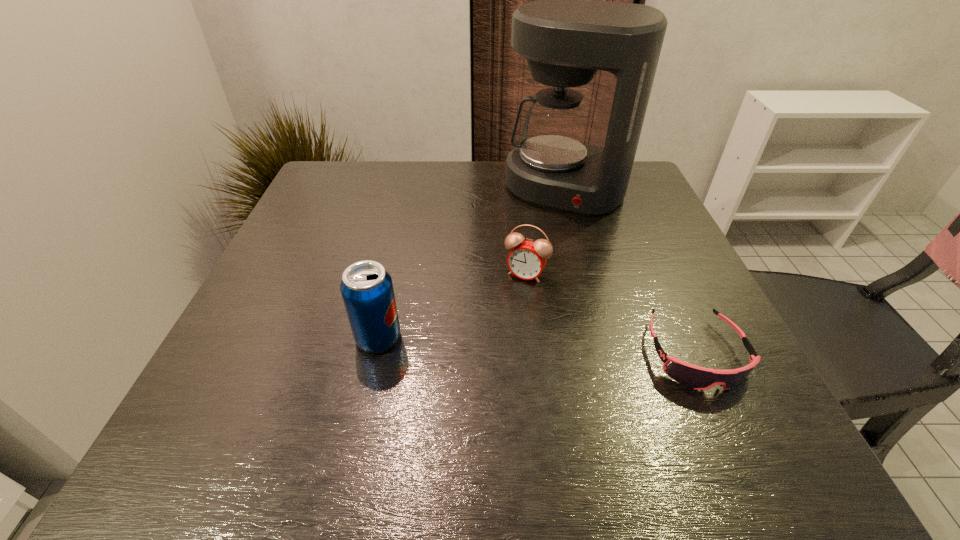
Locate an element on the screen. This screenshot has width=960, height=540. free space between the third shortest object and the goggles is located at coordinates (537, 346).

Where is `vacant point located between the tallest object and the pop soda`? Image resolution: width=960 pixels, height=540 pixels. vacant point located between the tallest object and the pop soda is located at coordinates 471,264.

Identify the location of vacant space that's between the farthest object and the second farthest object. (545, 232).

Find the location of a particular element. This screenshot has width=960, height=540. free space that is in between the shortest object and the third nearest object is located at coordinates (611, 314).

This screenshot has height=540, width=960. Find the location of `empty location between the coffee maker and the pop soda`. empty location between the coffee maker and the pop soda is located at coordinates (471, 264).

The image size is (960, 540). Identify the location of blank region between the alarm clock and the third shortest object. (452, 306).

Where is `free space between the coffee maker and the third tallest object`? This screenshot has height=540, width=960. free space between the coffee maker and the third tallest object is located at coordinates [545, 232].

You are a GUI agent. You are given a task and a screenshot of the screen. Output one action in this format:
    pyautogui.click(x=<x>, y=<y>)
    Task: Click on the object that is the closest one to the farthest object
    This screenshot has width=960, height=540.
    Given the screenshot: What is the action you would take?
    pyautogui.click(x=527, y=259)

Locate which object is the closest to the goggles. Please provide its 2D coordinates. Your answer should be formatted as a tuple, i.e. [(x, y)], where the tuple contains the x and y coordinates of a point satisfying the conditions above.

[(527, 259)]

Where is `vacant space that satisfies the following two spatial constraints: 1. on the back side of the tallest object; 2. on the right side of the alarm clock`? Image resolution: width=960 pixels, height=540 pixels. vacant space that satisfies the following two spatial constraints: 1. on the back side of the tallest object; 2. on the right side of the alarm clock is located at coordinates (516, 189).